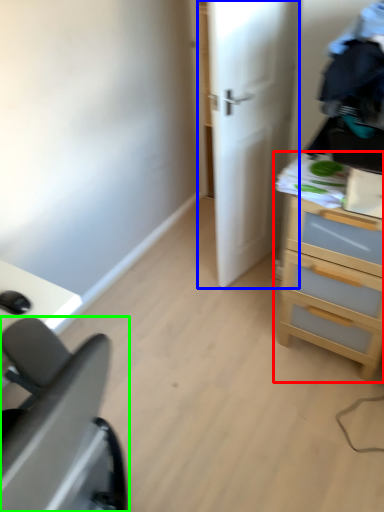
Question: Which object is positioned closest to chest of drawers (highlighted by a red box)? Select from door (highlighted by a blue box) and furniture (highlighted by a green box).

Choices:
 (A) door
 (B) furniture

Answer: (A)